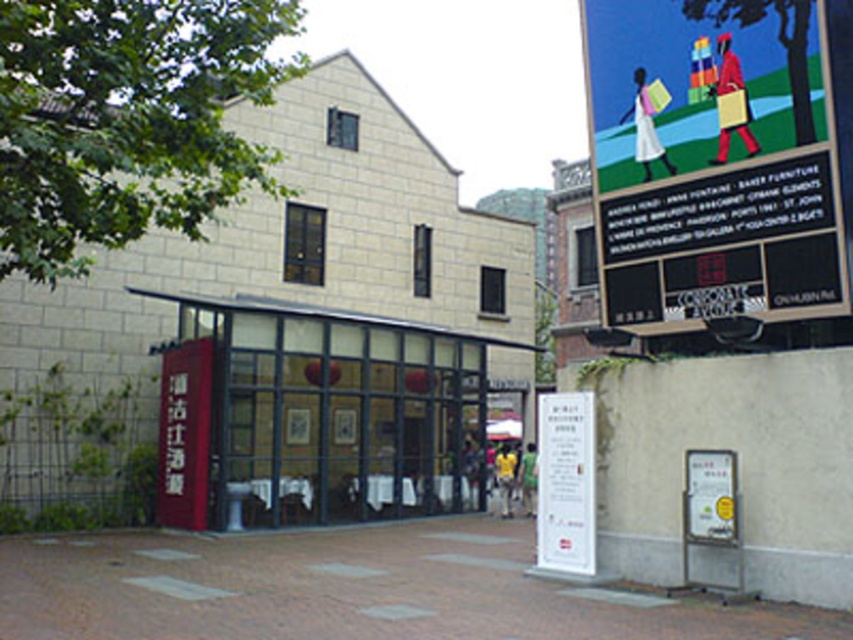
Is matte blue poster at upper right shorter than white paper sign at center?

No, matte blue poster at upper right is not shorter than white paper sign at center.

Is matte blue poster at upper right bigger than white paper sign at center?

Indeed, matte blue poster at upper right has a larger size compared to white paper sign at center.

At what (x,y) coordinates should I click in order to perform the action: click on matte blue poster at upper right. Please return your answer as a coordinate pair (x, y). Looking at the image, I should click on (712, 161).

Where is `matte blue poster at upper right`? The width and height of the screenshot is (853, 640). matte blue poster at upper right is located at coordinates (712, 161).